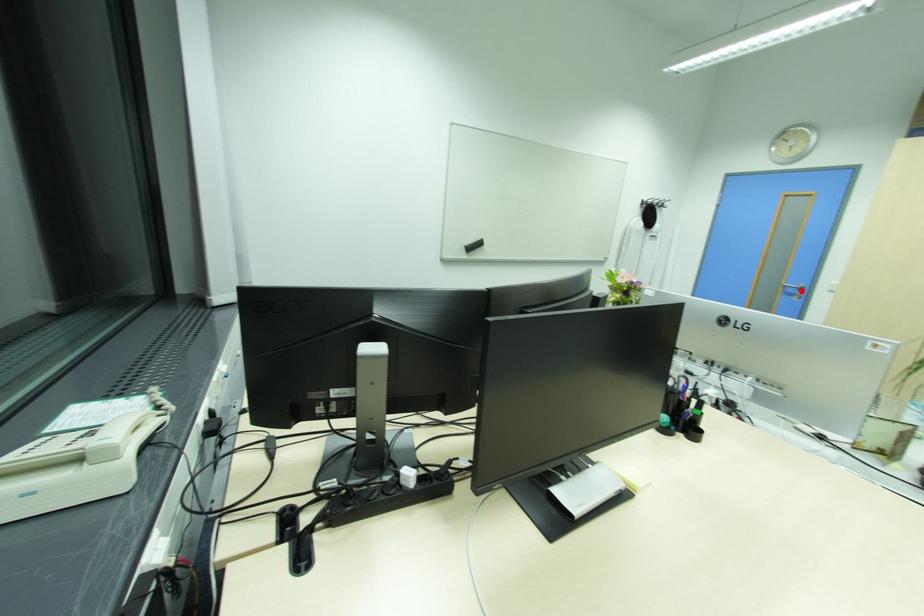
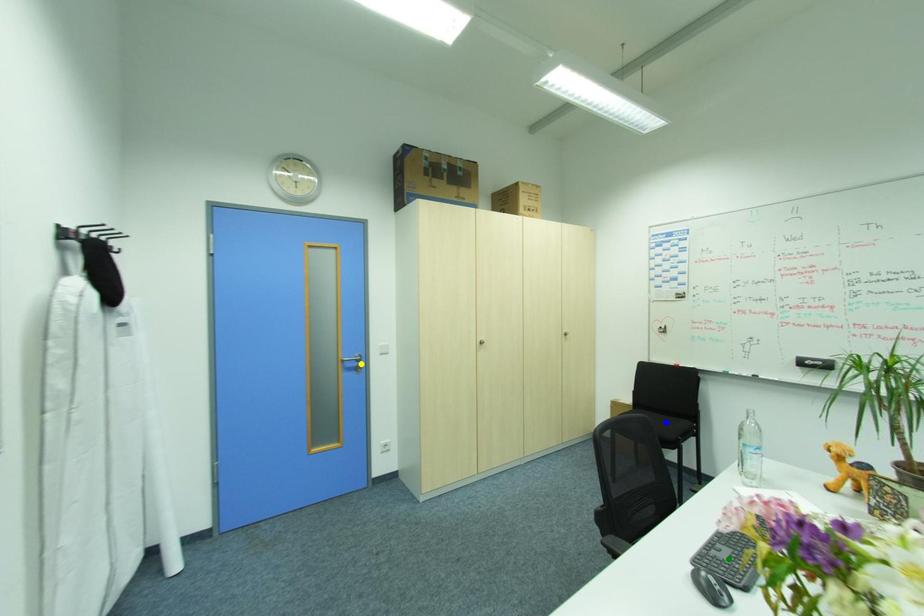
Question: I am providing you with two images of the same scene from different viewpoints. A red point is marked on the first image. You are given multiple points on the second image. Which spot in image 2 lines up with the point in image 1?

Choices:
 (A) blue point
 (B) yellow point
 (C) green point

Answer: (B)